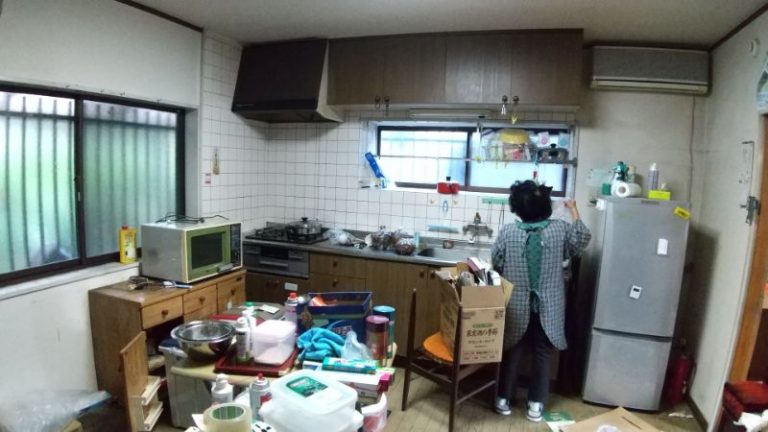
Locate an element on the screen. The height and width of the screenshot is (432, 768). ceiling is located at coordinates (647, 27).